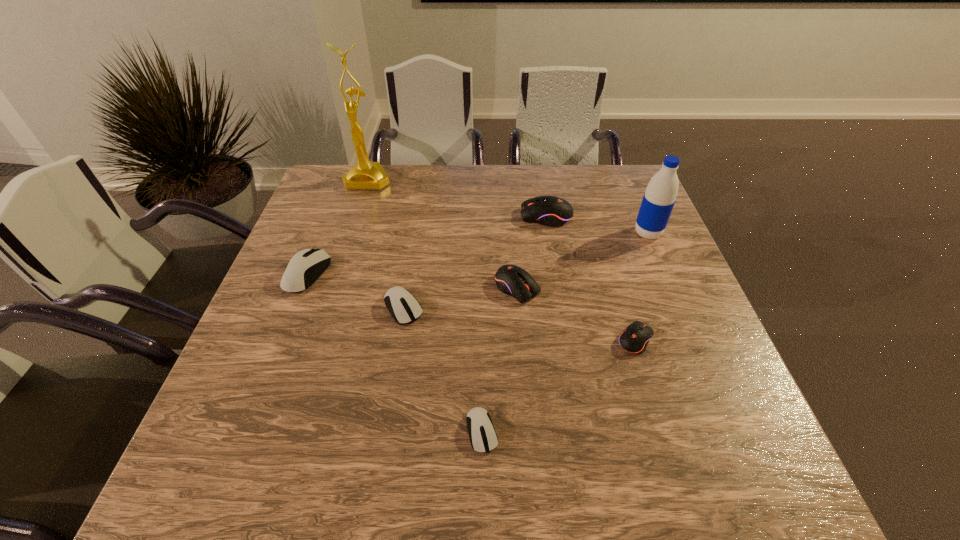
Choose which white mouse is the nearest neighbor to the fifth mouse from right to left. Please provide its 2D coordinates. Your answer should be formatted as a tuple, i.e. [(x, y)], where the tuple contains the x and y coordinates of a point satisfying the conditions above.

[(306, 266)]

Select which white mouse is the closest to the golden award. Please provide its 2D coordinates. Your answer should be formatted as a tuple, i.e. [(x, y)], where the tuple contains the x and y coordinates of a point satisfying the conditions above.

[(306, 266)]

Where is `free region that satisfies the following two spatial constraints: 1. on the back side of the rightmost object; 2. on the left side of the second smallest black computer mouse`? The width and height of the screenshot is (960, 540). free region that satisfies the following two spatial constraints: 1. on the back side of the rightmost object; 2. on the left side of the second smallest black computer mouse is located at coordinates (513, 233).

The image size is (960, 540). I want to click on free spot that satisfies the following two spatial constraints: 1. on the front-facing side of the golden award; 2. on the left side of the water bottle, so click(x=350, y=233).